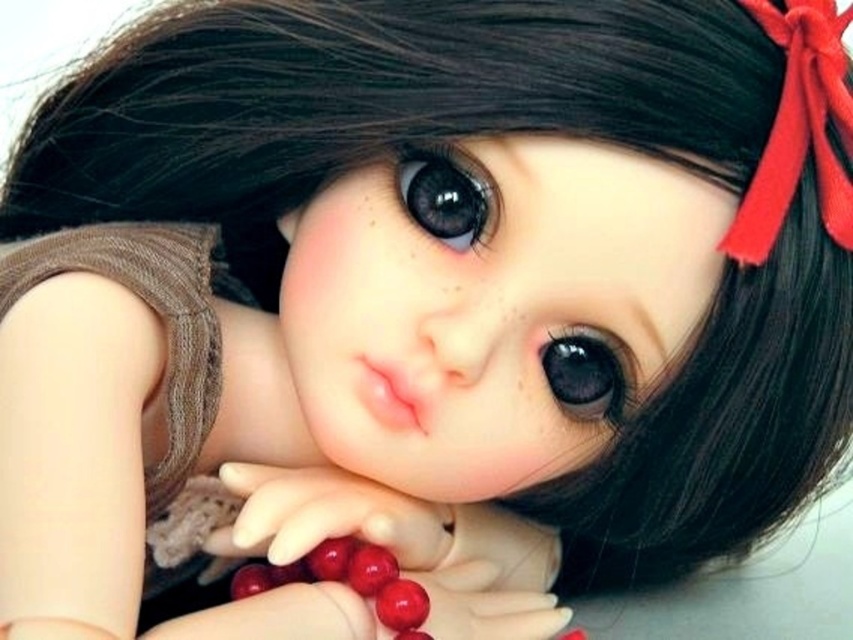
Question: Which point is closer to the camera?

Choices:
 (A) (352, 540)
 (B) (399, 579)
 (C) (436, 547)

Answer: (B)

Question: Can you confirm if shiny red beads at center is positioned to the right of glossy red berry at center?

Choices:
 (A) no
 (B) yes

Answer: (A)

Question: Is shiny red beads at center closer to the viewer compared to glossy red berry at center?

Choices:
 (A) yes
 (B) no

Answer: (A)

Question: Estimate the real-world distances between objects in this image. Which object is farther from the shiny red beads at center?

Choices:
 (A) smooth plastic beads at center
 (B) glossy red berry at center

Answer: (A)

Question: Can you confirm if shiny red beads at center is positioned to the right of glossy red berry at center?

Choices:
 (A) no
 (B) yes

Answer: (A)

Question: Which object is the closest to the glossy red berry at center?

Choices:
 (A) smooth plastic beads at center
 (B) shiny red beads at center

Answer: (B)